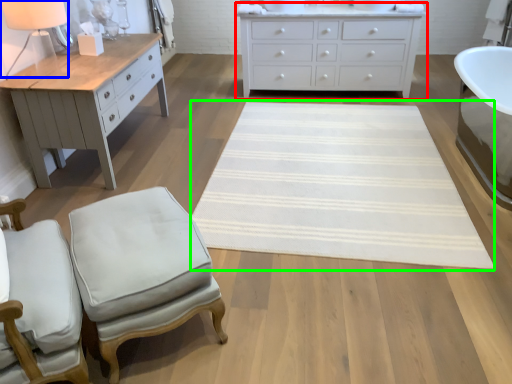
Question: Which object is the farthest from chest of drawers (highlighted by a red box)? Choose among these: table lamp (highlighted by a blue box) or mat (highlighted by a green box).

Choices:
 (A) table lamp
 (B) mat

Answer: (A)